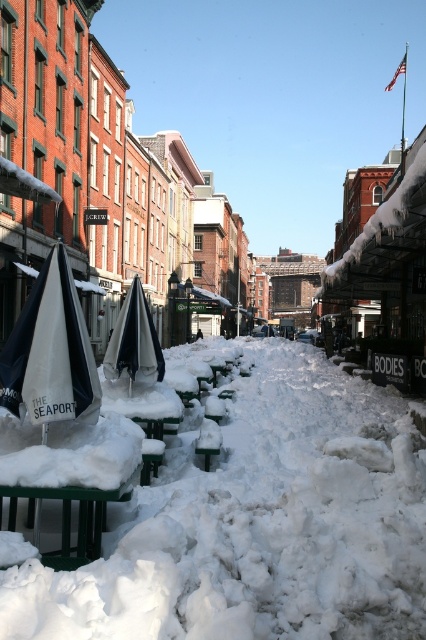
You are a city worker who needs to clear snow from the street. You see the white fluffy snow at center and the white matte umbrella at left. Which one is taller from the ground?

The white fluffy snow at center has a lesser height compared to white matte umbrella at left, so the white matte umbrella at left is taller.

You are a delivery robot with a 2 meter long package. You need to navigate through the snowy street and place the package between the white fluffy snow at center and the white matte umbrella at left. Can you fit the package in that space without overlapping either object?

The distance between the white fluffy snow at center and the white matte umbrella at left is 3.68 meters. Since the package is 2 meters long, there is enough space to place it between them without overlapping either object.